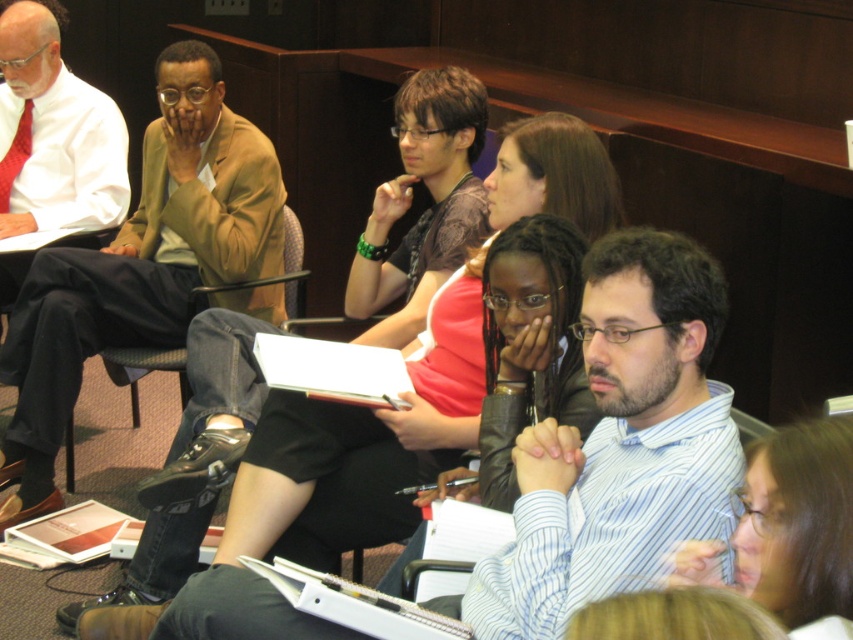
You are a student who wants to hang your light brown leather jacket at upper left on the back of the black leather chair at center. Is there enough vertical space for the jacket to fit without touching the ceiling?

The light brown leather jacket at upper left is much taller than the black leather chair at center, so hanging it on the chair might cause the jacket to touch the ceiling or not fit properly due to its greater height.

You are sitting in the back row of the lecture hall and want to hand a note to the person wearing the striped cotton shirt at center and sitting in the black leather chair at center. Which object should you aim for first to reach them?

You should aim for the striped cotton shirt at center first because it is closer to you than the black leather chair at center, so you can reach them by targeting the shirt first.